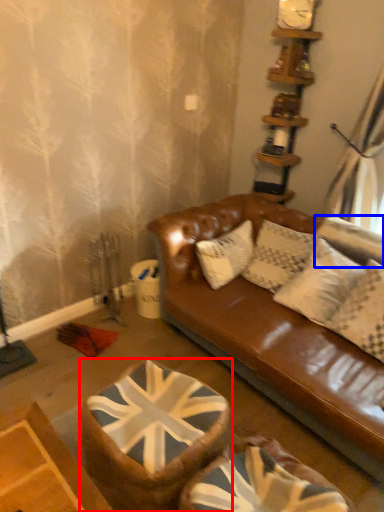
Question: Which object is further to the camera taking this photo, swivel chair (highlighted by a red box) or pillow (highlighted by a blue box)?

Choices:
 (A) swivel chair
 (B) pillow

Answer: (B)